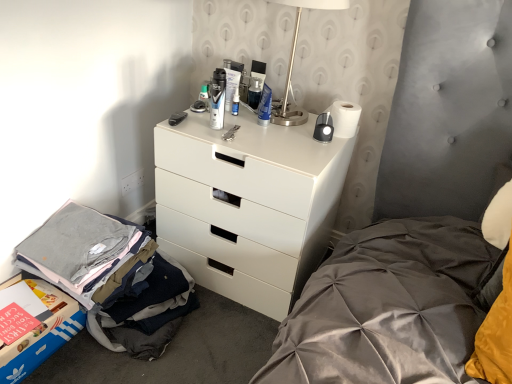
Identify the location of free space that is to the left of white matte toilet paper at upper right. Image resolution: width=512 pixels, height=384 pixels. (290, 129).